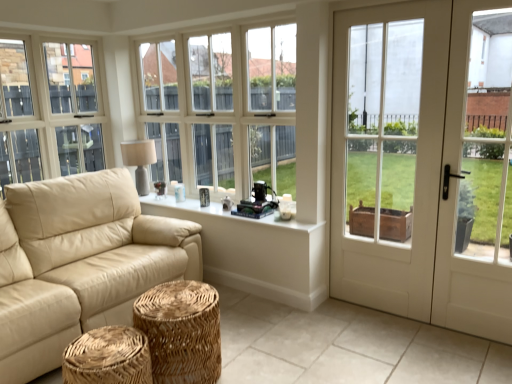
You are a GUI agent. You are given a task and a screenshot of the screen. Output one action in this format:
    pyautogui.click(x=<x>, y=<y>)
    Task: Click on the vacant space in front of white glossy door at right
    This screenshot has width=512, height=384.
    Given the screenshot: What is the action you would take?
    pyautogui.click(x=431, y=349)